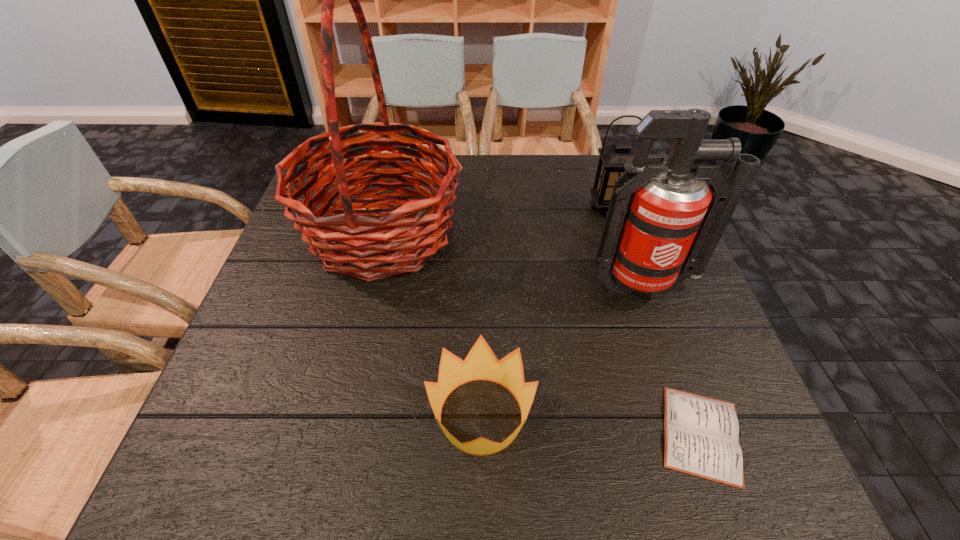
Where is `vacant space that satisfies the following two spatial constraints: 1. on the handle side of the crown; 2. on the right side of the tallest object`? vacant space that satisfies the following two spatial constraints: 1. on the handle side of the crown; 2. on the right side of the tallest object is located at coordinates (339, 415).